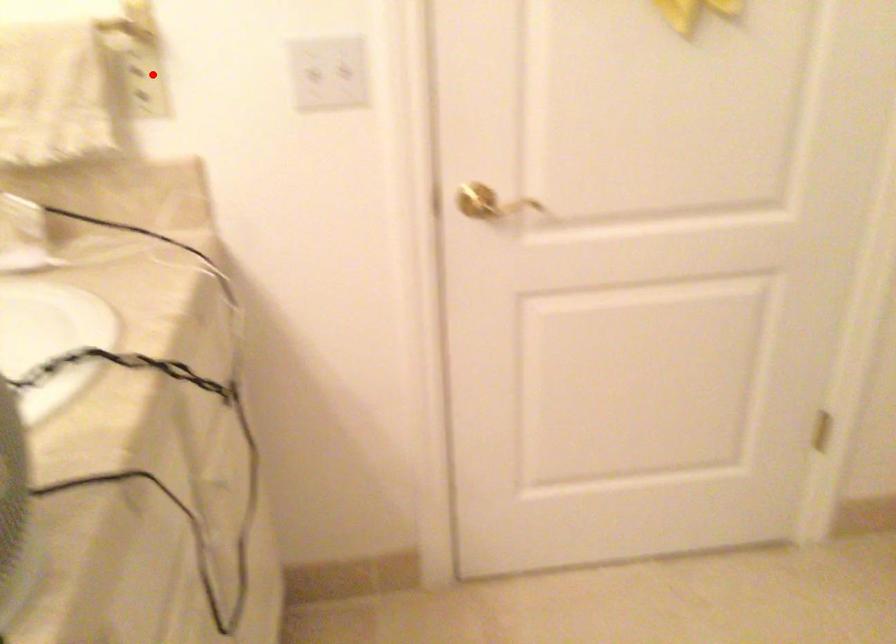
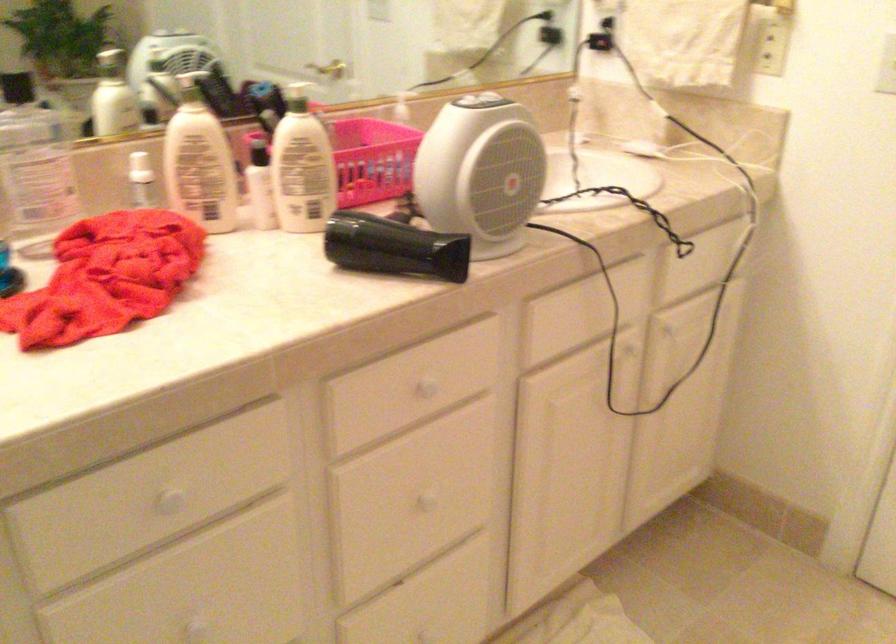
Question: I am providing you with two images of the same scene from different viewpoints. A red point is shown in image1. For the corresponding object point in image2, is it positioned nearer or farther from the camera?

Choices:
 (A) Nearer
 (B) Farther

Answer: (B)